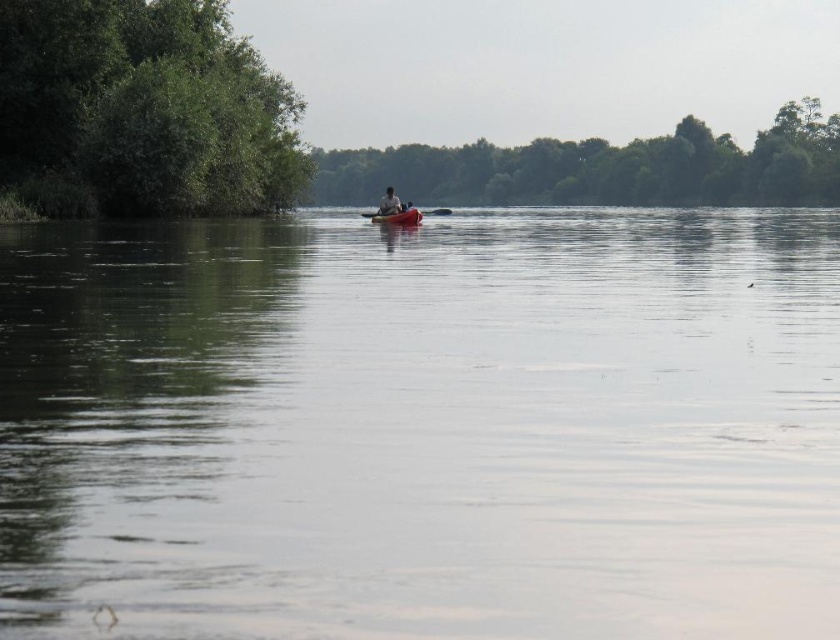
Question: Is smooth water at center below green leafy tree at center?

Choices:
 (A) no
 (B) yes

Answer: (B)

Question: Can you confirm if smooth water at center is positioned above green leafy tree at center?

Choices:
 (A) no
 (B) yes

Answer: (A)

Question: Is green leafy trees at left below matte red kayak at center?

Choices:
 (A) yes
 (B) no

Answer: (B)

Question: Which object is the farthest from the smooth water at center?

Choices:
 (A) green leafy trees at left
 (B) matte red kayak at center
 (C) green leafy tree at center
 (D) smooth plastic paddle at center

Answer: (C)

Question: Which of the following is the closest to the observer?

Choices:
 (A) green leafy trees at left
 (B) matte plastic kayak at center
 (C) green leafy tree at center

Answer: (A)

Question: Based on their relative distances, which object is farther from the smooth water at center?

Choices:
 (A) smooth plastic paddle at center
 (B) matte red kayak at center

Answer: (A)